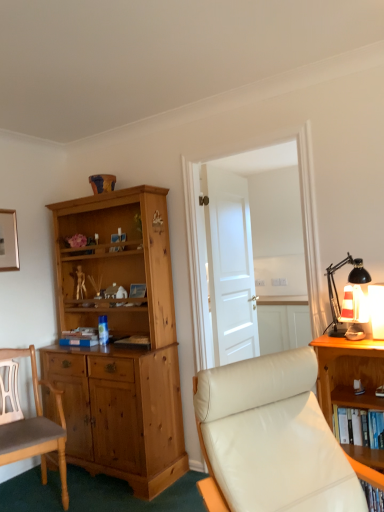
At what (x,y) coordinates should I click in order to perform the action: click on striped fabric lampshade at right. Please return your answer as a coordinate pair (x, y). The height and width of the screenshot is (512, 384). Looking at the image, I should click on point(349,295).

Identify the location of white glossy door at center. This screenshot has width=384, height=512. [x=250, y=245].

Consider the image. Measure the distance between hardcover book at center and camera.

hardcover book at center and camera are 2.67 meters apart from each other.

Where is `white matte door at center`? The height and width of the screenshot is (512, 384). white matte door at center is located at coordinates (230, 266).

Describe the element at coordinates (273, 439) in the screenshot. Image resolution: width=384 pixels, height=512 pixels. I see `white leather chair at center, the 1th chair in the front-to-back sequence` at that location.

Find the location of `striped fabric lampshade at right`. striped fabric lampshade at right is located at coordinates (349, 295).

Is point (238, 173) behind point (120, 340)?

Yes, it is behind point (120, 340).

Consider the image. Is white glossy door at center outside of hardcover book at center?

Yes.

Is hardcover book at center completely or partially outside of striped fabric lampshade at right?

hardcover book at center is positioned outside striped fabric lampshade at right.

Between point (139, 346) and point (352, 270), which one is positioned behind?

The point (139, 346) is farther from the camera.

Is hardcover book at center beside striped fabric lampshade at right?

No, hardcover book at center is not in contact with striped fabric lampshade at right.

Can you confirm if hardcover book at center is bigger than striped fabric lampshade at right?

Incorrect, hardcover book at center is not larger than striped fabric lampshade at right.

Is hardcover book at center facing away from light brown wood chair at left, acting as the second chair starting from the right?

No, light brown wood chair at left, acting as the second chair starting from the right, is not at the back of hardcover book at center.

Which of these two, hardcover book at center or light brown wood chair at left, acting as the second chair starting from the right, is smaller?

Smaller between the two is hardcover book at center.

Is there a large distance between hardcover book at center and light brown wood chair at left, acting as the second chair starting from the right?

No, there isn't a large distance between hardcover book at center and light brown wood chair at left, acting as the second chair starting from the right.

Based on the photo, does white matte door at center appear on the right side of hardcover book at center?

Yes, white matte door at center is to the right of hardcover book at center.

Is white matte door at center far away from hardcover book at center?

No, white matte door at center is not far from hardcover book at center.

From the image's perspective, which one is positioned higher, white matte door at center or hardcover book at center?

From the image's view, white matte door at center is above.

Between white matte door at center and hardcover book at center, which one has larger width?

hardcover book at center is wider.

From a real-world perspective, is white leather chair at center, the second chair from the left, under light brown wood chair at left, which appears as the 1th chair when viewed from the left?

No, from a real-world perspective, white leather chair at center, the second chair from the left, is not beneath light brown wood chair at left, which appears as the 1th chair when viewed from the left.

Is white leather chair at center, the second chair in the back-to-front sequence, bigger than light brown wood chair at left, the first chair positioned from the back?

Yes, white leather chair at center, the second chair in the back-to-front sequence, is bigger than light brown wood chair at left, the first chair positioned from the back.

From the image's perspective, who appears lower, white leather chair at center, the 1th chair viewed from the right, or light brown wood chair at left, the first chair positioned from the back?

light brown wood chair at left, the first chair positioned from the back, from the image's perspective.

Considering the sizes of white leather chair at center, the second chair in the back-to-front sequence, and light brown wood chair at left, which appears as the 1th chair when viewed from the left, in the image, is white leather chair at center, the second chair in the back-to-front sequence, wider or thinner than light brown wood chair at left, which appears as the 1th chair when viewed from the left,?

white leather chair at center, the second chair in the back-to-front sequence, is wider than light brown wood chair at left, which appears as the 1th chair when viewed from the left.

Does white matte door at center turn towards striped fabric lampshade at right?

No, white matte door at center is not facing towards striped fabric lampshade at right.

Do you think white matte door at center is within striped fabric lampshade at right, or outside of it?

white matte door at center cannot be found inside striped fabric lampshade at right.

Image resolution: width=384 pixels, height=512 pixels. I want to click on door located behind the striped fabric lampshade at right, so click(230, 266).

Identify the location of the 1st chair below the striped fabric lampshade at right (from the image's perspective). This screenshot has height=512, width=384. (273, 439).

Looking at this image, does striped fabric lampshade at right turn towards white leather chair at center, the second chair from the left?

No.

Based on the photo, is striped fabric lampshade at right surrounding white leather chair at center, the 1th chair viewed from the right?

No, striped fabric lampshade at right does not contain white leather chair at center, the 1th chair viewed from the right.

From a real-world perspective, does striped fabric lampshade at right stand above white leather chair at center, the second chair from the left?

Yes, from a real-world perspective, striped fabric lampshade at right is on top of white leather chair at center, the second chair from the left.

Locate an element on the screen. book below the white glossy door at center (from the image's perspective) is located at coordinates (134, 342).

Locate an element on the screen. The image size is (384, 512). table lamp located above the hardcover book at center (from the image's perspective) is located at coordinates (349, 295).

From the image, which object appears to be farther from white leather chair at center, the second chair from the left, light brown wood chair at left, acting as the second chair starting from the right, or striped fabric lampshade at right?

light brown wood chair at left, acting as the second chair starting from the right, lies further to white leather chair at center, the second chair from the left, than the other object.

Considering their positions, is wooden bookshelf at right positioned further to white matte door at center than white glossy door at center?

white glossy door at center is positioned further to the anchor white matte door at center.

Estimate the real-world distances between objects in this image. Which object is closer to striped fabric lampshade at right, hardcover book at center or wooden bookshelf at right?

wooden bookshelf at right is closer to striped fabric lampshade at right.

Based on their spatial positions, is wooden bookshelf at right or striped fabric lampshade at right further from white leather chair at center, the 1th chair in the front-to-back sequence?

striped fabric lampshade at right is positioned further to the anchor white leather chair at center, the 1th chair in the front-to-back sequence.

Which object lies nearer to the anchor point white leather chair at center, the second chair in the back-to-front sequence, striped fabric lampshade at right or wooden bookshelf at right?

wooden bookshelf at right.

Considering their positions, is wooden bookshelf at right positioned further to white leather chair at center, the second chair from the left, than white matte door at center?

Based on the image, white matte door at center appears to be further to white leather chair at center, the second chair from the left.

From the image, which object appears to be nearer to striped fabric lampshade at right, white glossy door at center or wooden bookshelf at right?

wooden bookshelf at right.

Estimate the real-world distances between objects in this image. Which object is closer to wooden bookshelf at right, striped fabric lampshade at right or light brown wood chair at left, acting as the second chair starting from the right?

striped fabric lampshade at right.

Image resolution: width=384 pixels, height=512 pixels. I want to click on glass door located between white leather chair at center, the 1th chair viewed from the right, and hardcover book at center in the depth direction, so click(250, 245).

This screenshot has height=512, width=384. I want to click on table lamp between white glossy door at center and wooden bookshelf at right in the vertical direction, so click(349, 295).

Image resolution: width=384 pixels, height=512 pixels. Identify the location of table lamp positioned between wooden bookshelf at right and white matte door at center from near to far. (349, 295).

The image size is (384, 512). Find the location of `glass door positioned between wooden bookshelf at right and white matte door at center from near to far`. glass door positioned between wooden bookshelf at right and white matte door at center from near to far is located at coordinates (250, 245).